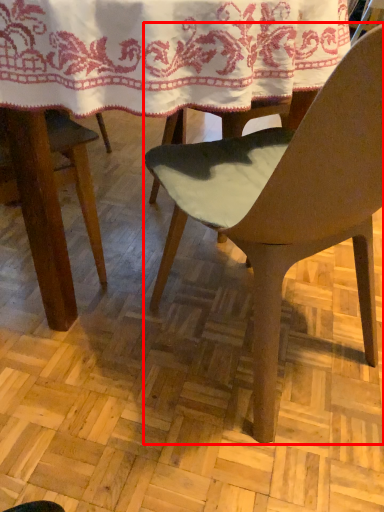
Question: Where is chair (annotated by the red box) located in relation to blanket in the image?

Choices:
 (A) left
 (B) right

Answer: (B)